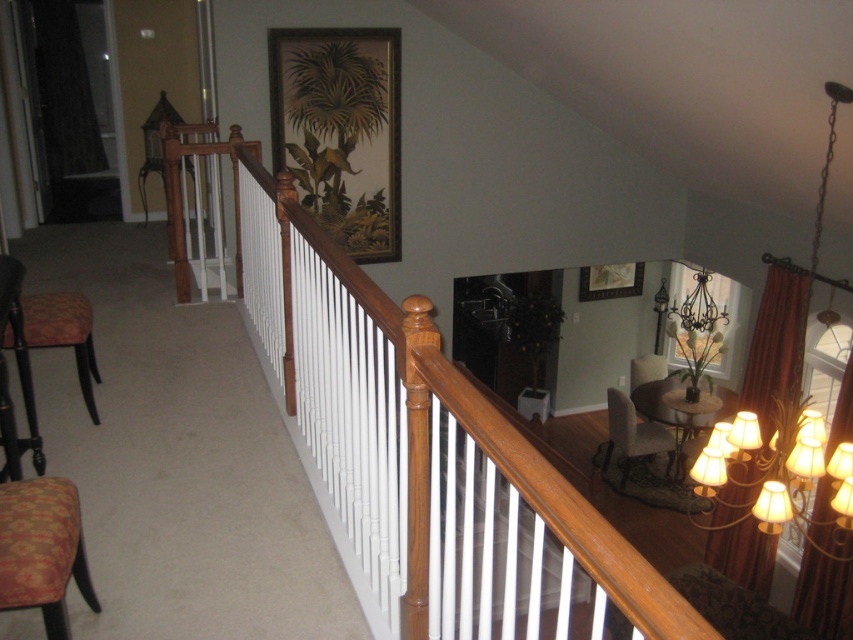
Which is behind, point (364, 376) or point (44, 573)?

The point (364, 376) is behind.

Does point (631, 618) come farther from viewer compared to point (10, 564)?

No, (631, 618) is in front of (10, 564).

Identify the location of wooden rail at upper left. (418, 449).

Who is more forward, (625, 436) or (804, 308)?

Point (804, 308) is in front.

Can you confirm if velvet beige armchair at lower right is taller than gold fabric chandelier at upper right?

In fact, velvet beige armchair at lower right may be shorter than gold fabric chandelier at upper right.

Is point (608, 442) closer to viewer compared to point (820, 170)?

No, it is not.

Locate an element on the screen. The width and height of the screenshot is (853, 640). velvet beige armchair at lower right is located at coordinates (633, 436).

Who is positioned more to the left, patterned fabric armchair at lower left or patterned fabric stool at left?

patterned fabric stool at left is more to the left.

Which is more to the right, patterned fabric armchair at lower left or patterned fabric stool at left?

From the viewer's perspective, patterned fabric armchair at lower left appears more on the right side.

Which is in front, point (6, 609) or point (22, 330)?

Point (6, 609) is in front.

The width and height of the screenshot is (853, 640). I want to click on patterned fabric armchair at lower left, so click(42, 548).